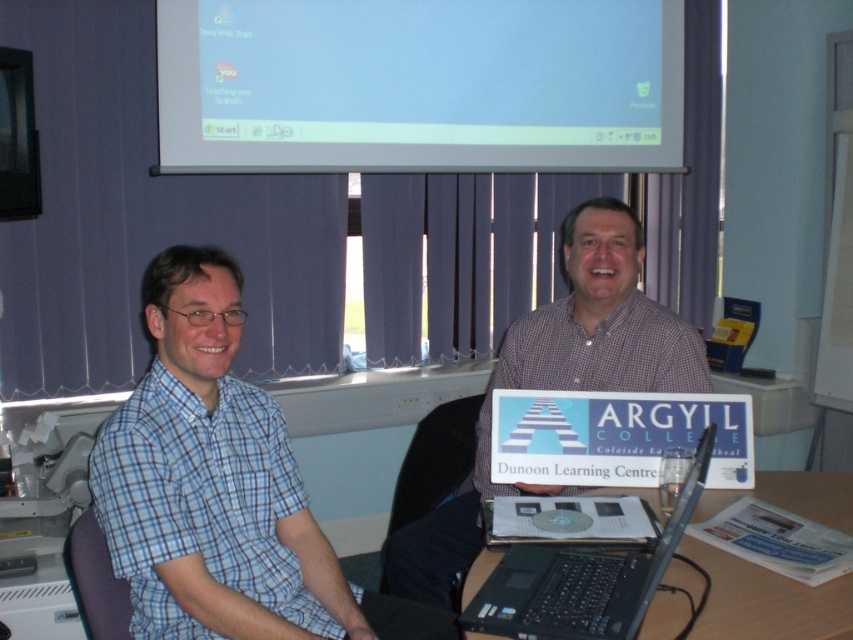
Question: Considering the real-world distances, which object is closest to the white glossy screen at upper center?

Choices:
 (A) blue checkered shirt at left
 (B) black plastic laptop at center
 (C) checkered shirt at center

Answer: (C)

Question: Estimate the real-world distances between objects in this image. Which object is closer to the checkered shirt at center?

Choices:
 (A) blue checkered shirt at left
 (B) black plastic laptop at center

Answer: (B)

Question: Which object appears closest to the camera in this image?

Choices:
 (A) checkered shirt at center
 (B) white glossy screen at upper center

Answer: (A)

Question: Can you confirm if white glossy screen at upper center is bigger than blue checkered shirt at left?

Choices:
 (A) no
 (B) yes

Answer: (B)

Question: Can you confirm if blue checkered shirt at left is smaller than black plastic laptop at center?

Choices:
 (A) no
 (B) yes

Answer: (A)

Question: Does blue checkered shirt at left appear under black plastic laptop at center?

Choices:
 (A) no
 (B) yes

Answer: (A)